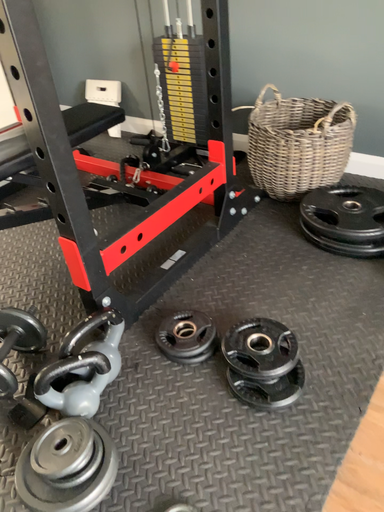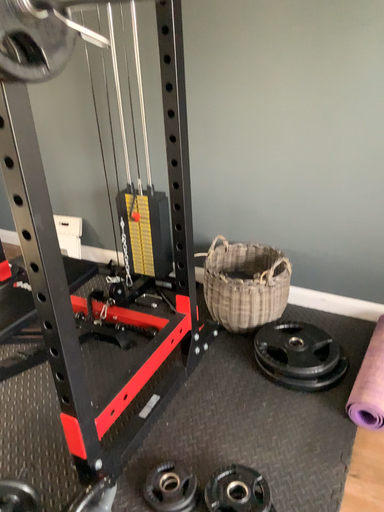
Question: Which way did the camera rotate in the video?

Choices:
 (A) rotated downward
 (B) rotated upward

Answer: (B)